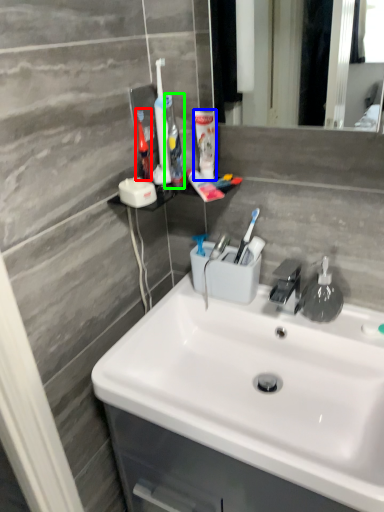
Question: Which object is the closest to the toothbrush (highlighted by a red box)? Choose among these: mouthwash (highlighted by a blue box) or toothbrush (highlighted by a green box).

Choices:
 (A) mouthwash
 (B) toothbrush

Answer: (B)